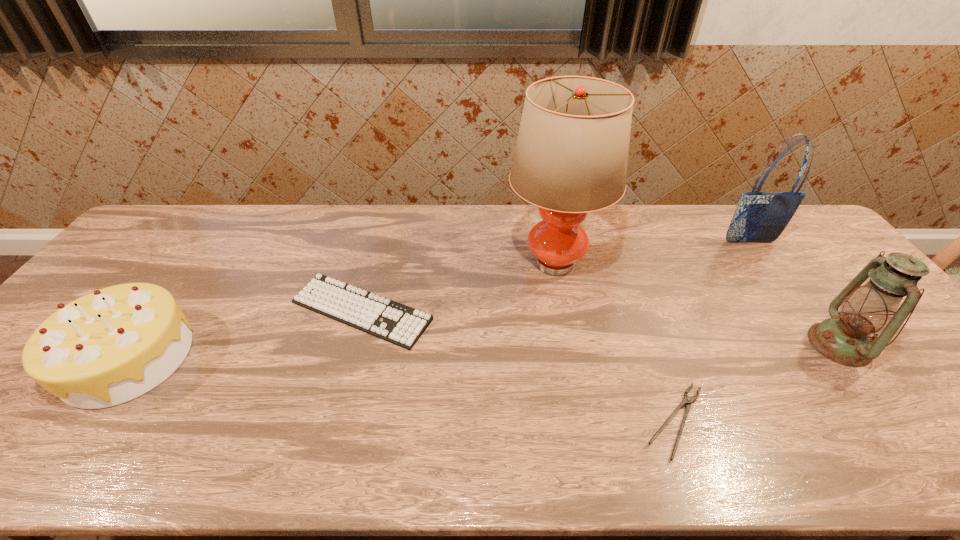
Where is `vacant space located 0.110m on the left of the third tallest object`? vacant space located 0.110m on the left of the third tallest object is located at coordinates (769, 345).

Locate an element on the screen. free space located on the left of the third shortest object is located at coordinates click(36, 357).

Locate an element on the screen. The image size is (960, 540). free space located 0.160m on the left of the fifth object from right to left is located at coordinates (230, 310).

Find the location of a particular element. vacant region located on the right of the tongs is located at coordinates (757, 421).

Where is `lamp that is at the far edge`? The width and height of the screenshot is (960, 540). lamp that is at the far edge is located at coordinates (571, 155).

This screenshot has width=960, height=540. Identify the location of shopping bag present at the far edge. (759, 217).

Locate an element on the screen. The width and height of the screenshot is (960, 540). object that is at the near edge is located at coordinates (687, 400).

Locate an element on the screen. The width and height of the screenshot is (960, 540). object present at the left edge is located at coordinates (115, 344).

This screenshot has height=540, width=960. Find the location of `shopping bag located at the right edge`. shopping bag located at the right edge is located at coordinates (759, 217).

Find the location of a particular element. The width and height of the screenshot is (960, 540). oil lamp at the right edge is located at coordinates coord(845,338).